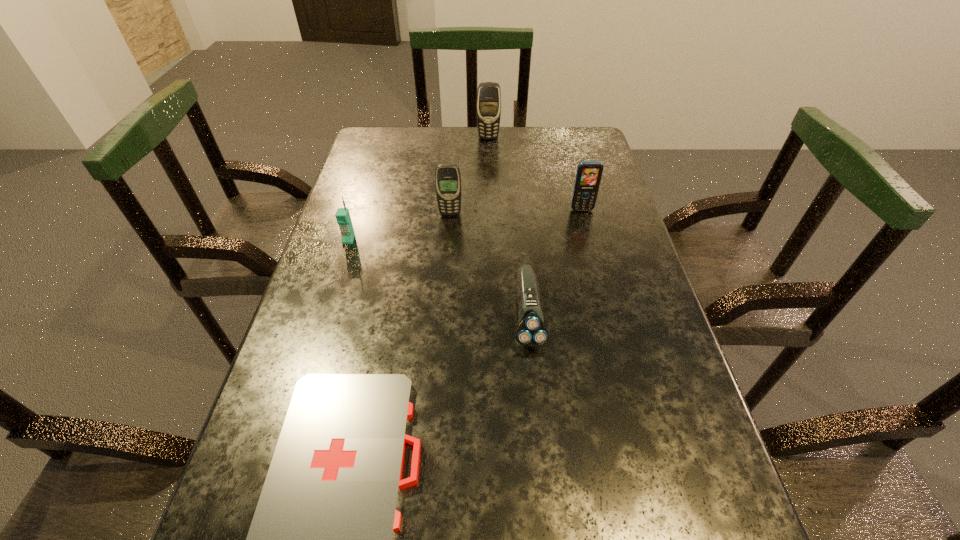
Point out which object is positioned as the fourth nearest to the fourth farthest object. Please provide its 2D coordinates. Your answer should be formatted as a tuple, i.e. [(x, y)], where the tuple contains the x and y coordinates of a point satisfying the conditions above.

[(489, 94)]

Point out which cellular telephone is positioned as the second nearest to the shortest cellular telephone. Please provide its 2D coordinates. Your answer should be formatted as a tuple, i.e. [(x, y)], where the tuple contains the x and y coordinates of a point satisfying the conditions above.

[(489, 94)]

Identify which cellular telephone is the closest to the third farthest cellular telephone. Please provide its 2D coordinates. Your answer should be formatted as a tuple, i.e. [(x, y)], where the tuple contains the x and y coordinates of a point satisfying the conditions above.

[(343, 218)]